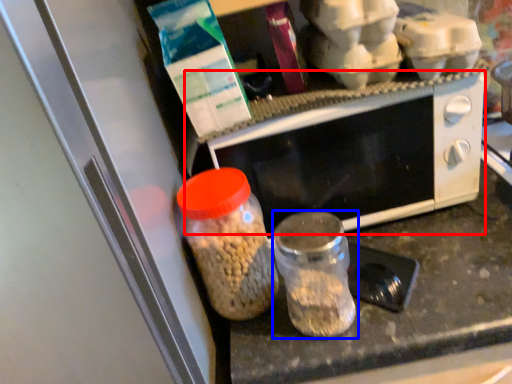
Question: Among these objects, which one is nearest to the camera, microwave oven (highlighted by a red box) or bottle (highlighted by a blue box)?

Choices:
 (A) microwave oven
 (B) bottle

Answer: (B)